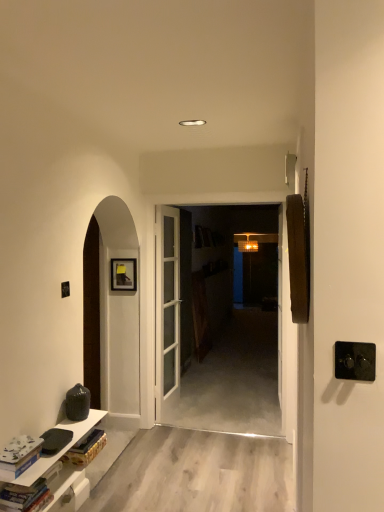
Question: Is black plastic door handle at right in front of or behind white matte book at lower left, the 2th book from the bottom, in the image?

Choices:
 (A) front
 (B) behind

Answer: (A)

Question: Considering the positions of black plastic door handle at right and white matte book at lower left, which appears as the first book when viewed from the top, in the image, is black plastic door handle at right bigger or smaller than white matte book at lower left, which appears as the first book when viewed from the top,?

Choices:
 (A) big
 (B) small

Answer: (B)

Question: Which object is positioned closest to the white glossy cabinet at lower left?

Choices:
 (A) white matte book at lower left, the 2th book from the bottom
 (B) hardcover book at lower left, which is the 2th book from top to bottom
 (C) black plastic door handle at right

Answer: (A)

Question: Based on their relative distances, which object is farther from the white glossy cabinet at lower left?

Choices:
 (A) black plastic door handle at right
 (B) hardcover book at lower left, which is counted as the first book, starting from the bottom
 (C) white matte book at lower left, which appears as the first book when viewed from the top

Answer: (A)